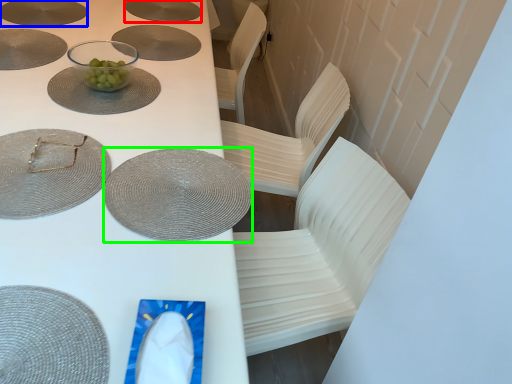
Question: Which object is the farthest from platter (highlighted by a red box)? Choose among these: platter (highlighted by a blue box) or tableware (highlighted by a green box).

Choices:
 (A) platter
 (B) tableware

Answer: (B)